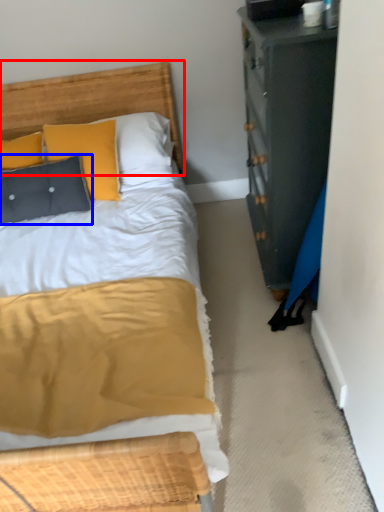
Question: Among these objects, which one is farthest to the camera, headboard (highlighted by a red box) or pillow (highlighted by a blue box)?

Choices:
 (A) headboard
 (B) pillow

Answer: (B)